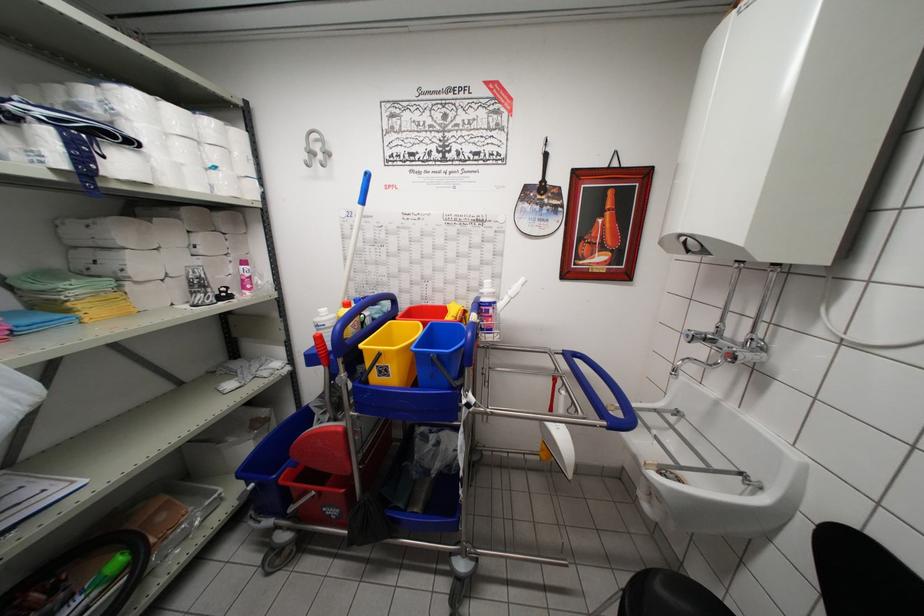
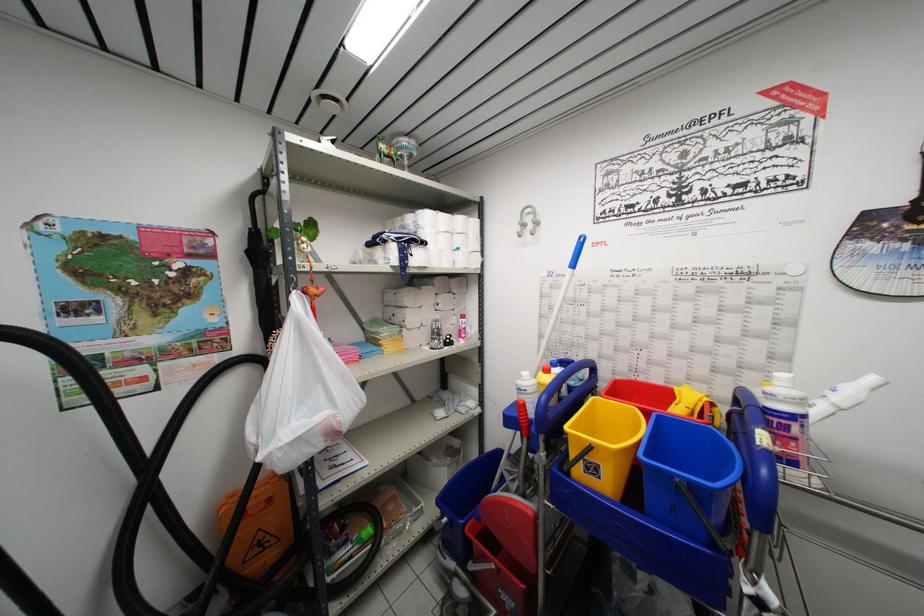
Where in the second image is the point corresponding to [382,381] from the first image?

(589, 477)